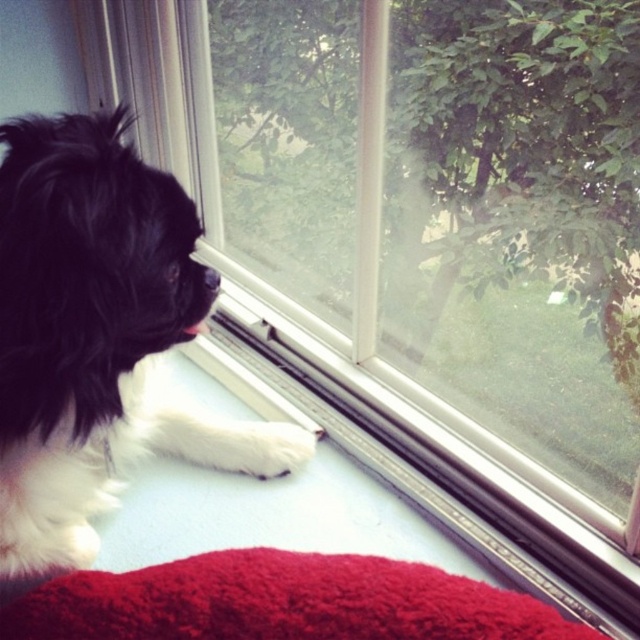
You are designing a custom dog bed for the black fluffy dog at left. The bed must be large enough to accommodate its size. Given that the fluffy red blanket at lower center is currently under the dog, can you determine if the dog will fit on the blanket if the bed is made to the same size as the blanket?

The black fluffy dog at left is narrower than the fluffy red blanket at lower center, so the dog will fit comfortably on the blanket if the bed is made to the same size as the blanket.

You are standing in the room and want to place a small plant pot on the windowsill where the black fluffy dog at left is resting. Based on the dog

The black fluffy dog at left is located at point (97, 336), so placing the plant pot there may disturb the dog as it is currently occupying that spot.